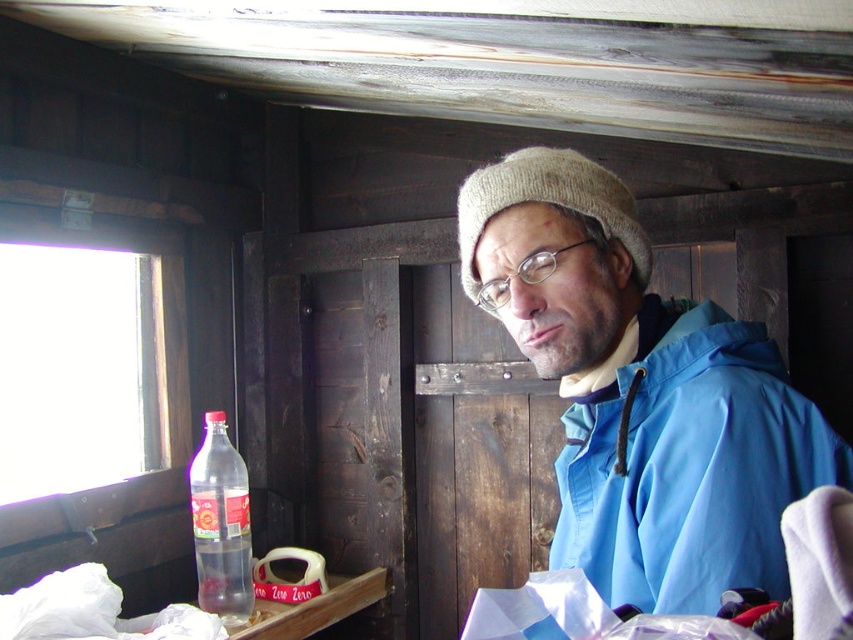
Does point (648, 243) lie behind point (236, 480)?

That is False.

Can you confirm if knitted beige hat at upper center is smaller than translucent plastic bottle at lower left?

Indeed, knitted beige hat at upper center has a smaller size compared to translucent plastic bottle at lower left.

Is point (457, 237) positioned before point (202, 600)?

No, (457, 237) is further to viewer.

Find the location of a particular element. This screenshot has width=853, height=640. knitted beige hat at upper center is located at coordinates (548, 204).

How distant is blue fabric jacket at center from knitted beige hat at upper center?

The distance of blue fabric jacket at center from knitted beige hat at upper center is 5.06 inches.

Is point (758, 522) farther from camera compared to point (514, 163)?

That is False.

The image size is (853, 640). In order to click on blue fabric jacket at center in this screenshot , I will do `click(641, 392)`.

Does blue fabric jacket at center come behind translucent plastic bottle at lower left?

No, it is not.

Does point (733, 387) come farther from viewer compared to point (202, 433)?

No, it is in front of (202, 433).

At what (x,y) coordinates should I click in order to perform the action: click on blue fabric jacket at center. Please return your answer as a coordinate pair (x, y). The image size is (853, 640). Looking at the image, I should click on (641, 392).